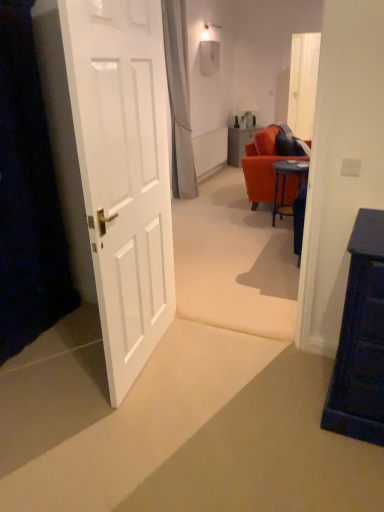
Find the location of a particular element. blue glossy desk at center is located at coordinates (285, 183).

I want to click on white glossy door at left, so click(x=123, y=172).

What do you see at coordinates (123, 172) in the screenshot? Image resolution: width=384 pixels, height=512 pixels. I see `white glossy door at left` at bounding box center [123, 172].

Measure the distance between matte orange table at center and camera.

The depth of matte orange table at center is 22.53 feet.

Locate an element on the screen. This screenshot has height=512, width=384. transparent glass door at upper center is located at coordinates (303, 83).

From the image's perspective, is white glossy door at left located above matte white lampshade at center?

No, from the image's perspective, white glossy door at left is not on top of matte white lampshade at center.

Can you tell me how much white glossy door at left and matte white lampshade at center differ in facing direction?

There is a 50.2-degree angle between the facing directions of white glossy door at left and matte white lampshade at center.

Considering the relative positions of white glossy door at left and matte white lampshade at center in the image provided, is white glossy door at left to the right of matte white lampshade at center from the viewer's perspective?

No, white glossy door at left is not to the right of matte white lampshade at center.

The width and height of the screenshot is (384, 512). In order to click on lamp on the right side of white glossy door at left in this screenshot , I will do `click(247, 104)`.

Is white fabric curtain at upper center in front of or behind blue glossy desk at center in the image?

Visually, white fabric curtain at upper center is located behind blue glossy desk at center.

From a real-world perspective, between white fabric curtain at upper center and blue glossy desk at center, who is vertically lower?

From a 3D spatial view, blue glossy desk at center is below.

Does white fabric curtain at upper center contain blue glossy desk at center?

No, blue glossy desk at center is not inside white fabric curtain at upper center.

Measure the distance from white fabric curtain at upper center to blue glossy desk at center.

white fabric curtain at upper center and blue glossy desk at center are 5.90 feet apart from each other.

Is the position of transparent glass door at upper center less distant than that of matte orange table at center?

Yes, transparent glass door at upper center is closer to the camera.

The image size is (384, 512). Identify the location of glass door located above the matte orange table at center (from a real-world perspective). (303, 83).

Is transparent glass door at upper center touching matte orange table at center?

They are not placed beside each other.

Is point (250, 105) more distant than point (115, 258)?

That is True.

Measure the distance from matte white lampshade at center to white glossy door at left.

5.61 meters.

From the image's perspective, is matte white lampshade at center located above or below white glossy door at left?

matte white lampshade at center is situated higher than white glossy door at left in the image.

Is white glossy door at left surrounded by matte white lampshade at center?

No, white glossy door at left is not inside matte white lampshade at center.

Considering the sizes of objects matte orange table at center and blue glossy desk at center in the image provided, who is smaller, matte orange table at center or blue glossy desk at center?

blue glossy desk at center.

From the image's perspective, which one is positioned lower, matte orange table at center or blue glossy desk at center?

blue glossy desk at center, from the image's perspective.

Where is `desk on the right of matte orange table at center`? Image resolution: width=384 pixels, height=512 pixels. desk on the right of matte orange table at center is located at coordinates (285, 183).

Does white fabric curtain at upper center have a lesser height compared to white glossy door at left?

No.

Between white fabric curtain at upper center and white glossy door at left, which one appears on the right side from the viewer's perspective?

Positioned to the right is white fabric curtain at upper center.

Image resolution: width=384 pixels, height=512 pixels. What are the coordinates of `curtain above the white glossy door at left (from the image's perspective)` in the screenshot? It's located at (179, 98).

Is white fabric curtain at upper center outside of white glossy door at left?

white fabric curtain at upper center lies outside white glossy door at left's area.

The width and height of the screenshot is (384, 512). Identify the location of desk lying below the transparent glass door at upper center (from the image's perspective). (285, 183).

Which is behind, blue glossy desk at center or transparent glass door at upper center?

transparent glass door at upper center is behind.

Consider the image. From the image's perspective, is blue glossy desk at center positioned above or below transparent glass door at upper center?

Clearly, from the image's perspective, blue glossy desk at center is below transparent glass door at upper center.

At what (x,y) coordinates should I click in order to perform the action: click on door lying on the left of matte white lampshade at center. Please return your answer as a coordinate pair (x, y). This screenshot has width=384, height=512. Looking at the image, I should click on (123, 172).

Locate an element on the screen. This screenshot has height=512, width=384. desk below the white fabric curtain at upper center (from the image's perspective) is located at coordinates (285, 183).

Based on the photo, considering their positions, is matte orange table at center positioned closer to white fabric curtain at upper center than transparent glass door at upper center?

matte orange table at center.

Considering their positions, is white glossy door at left positioned further to white fabric curtain at upper center than matte white lampshade at center?

Based on the image, white glossy door at left appears to be further to white fabric curtain at upper center.

Which object lies nearer to the anchor point white fabric curtain at upper center, matte white lampshade at center or white glossy door at left?

matte white lampshade at center is closer to white fabric curtain at upper center.

When comparing their distances from transparent glass door at upper center, does matte orange table at center or matte white lampshade at center seem further?

matte orange table at center lies further to transparent glass door at upper center than the other object.

Looking at the image, which one is located closer to transparent glass door at upper center, white glossy door at left or matte orange table at center?

The object closer to transparent glass door at upper center is matte orange table at center.

Considering their positions, is blue glossy desk at center positioned closer to white glossy door at left than matte white lampshade at center?

blue glossy desk at center lies closer to white glossy door at left than the other object.

Estimate the real-world distances between objects in this image. Which object is further from matte white lampshade at center, matte orange table at center or white fabric curtain at upper center?

white fabric curtain at upper center.

Considering their positions, is matte white lampshade at center positioned closer to blue glossy desk at center than matte orange table at center?

Based on the image, matte orange table at center appears to be nearer to blue glossy desk at center.

Locate an element on the screen. This screenshot has width=384, height=512. glass door located between blue glossy desk at center and matte orange table at center in the depth direction is located at coordinates point(303,83).

Locate an element on the screen. This screenshot has width=384, height=512. lamp between blue glossy desk at center and matte orange table at center from front to back is located at coordinates [x=247, y=104].

In order to click on lamp between matte orange table at center and transparent glass door at upper center from left to right in this screenshot , I will do `click(247, 104)`.

Locate an element on the screen. The image size is (384, 512). desk located between white glossy door at left and white fabric curtain at upper center in the depth direction is located at coordinates (285, 183).